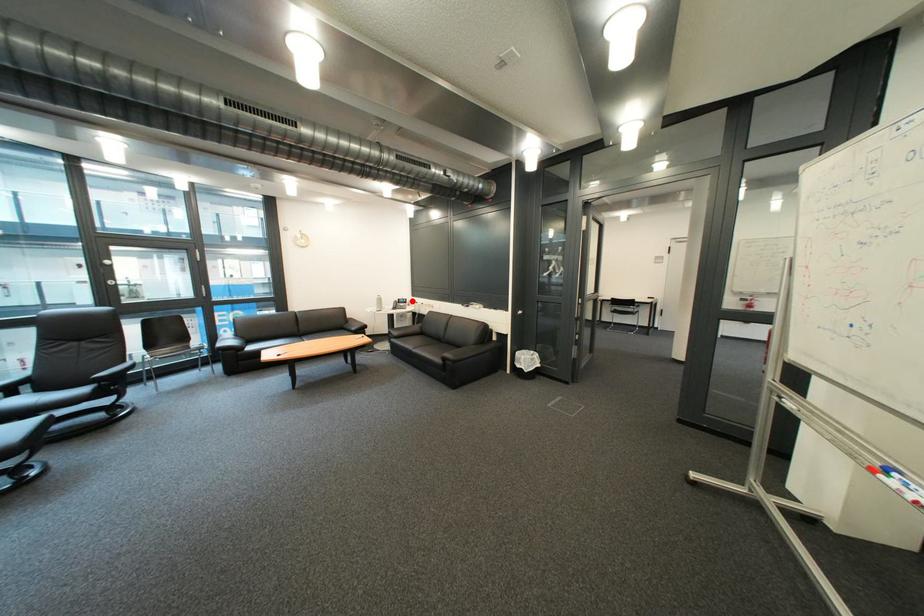
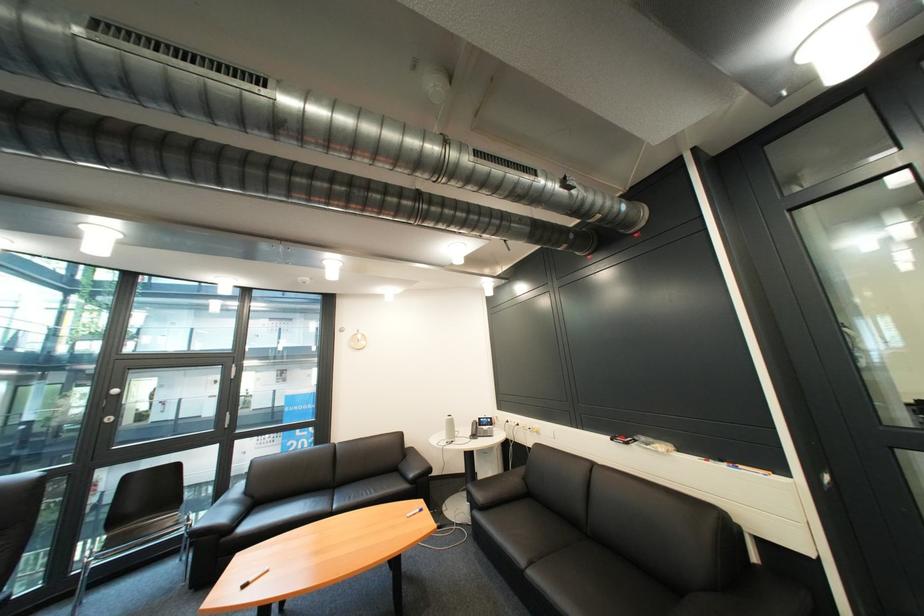
Question: I am providing you with two images of the same scene from different viewpoints. Given a red point in image1, look at the same physical point in image2. Is it:

Choices:
 (A) Closer to the viewpoint
 (B) Farther from the viewpoint

Answer: (B)